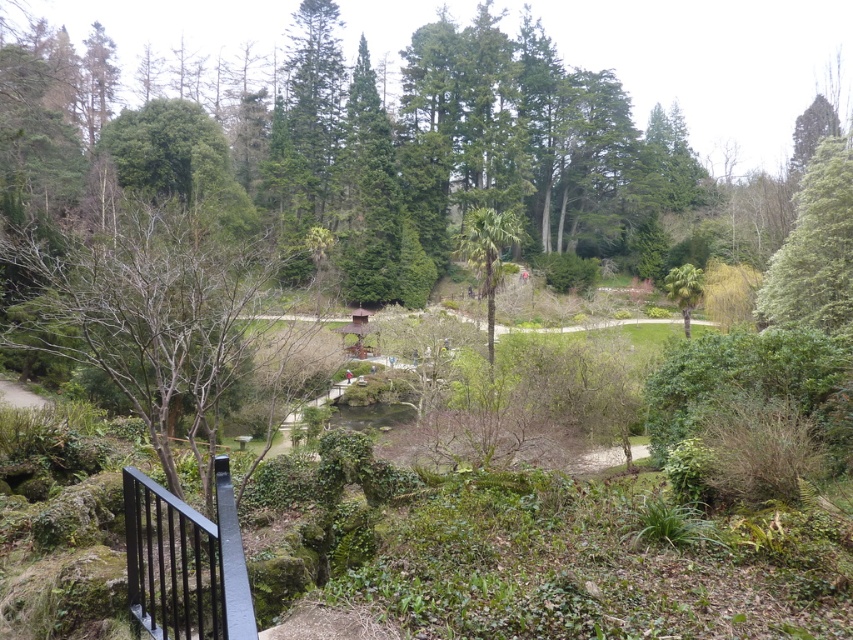
Who is positioned more to the left, bare branches at center or green leafy palm at center-right?

bare branches at center is more to the left.

Does point (207, 401) come closer to viewer compared to point (676, 296)?

Yes.

The image size is (853, 640). In order to click on bare branches at center in this screenshot , I will do `click(154, 317)`.

Between black metal rail at lower left and green leafy palm at center-right, which one appears on the right side from the viewer's perspective?

green leafy palm at center-right

Image resolution: width=853 pixels, height=640 pixels. What do you see at coordinates (184, 561) in the screenshot? I see `black metal rail at lower left` at bounding box center [184, 561].

Between point (239, 563) and point (666, 278), which one is positioned in front?

Positioned in front is point (239, 563).

The width and height of the screenshot is (853, 640). I want to click on black metal rail at lower left, so click(184, 561).

Which is more to the right, bare branches at center or green leafy palm tree at center?

From the viewer's perspective, green leafy palm tree at center appears more on the right side.

Does bare branches at center have a greater height compared to green leafy palm tree at center?

In fact, bare branches at center may be shorter than green leafy palm tree at center.

Is point (125, 380) farther from viewer compared to point (473, 259)?

No.

Locate an element on the screen. bare branches at center is located at coordinates (154, 317).